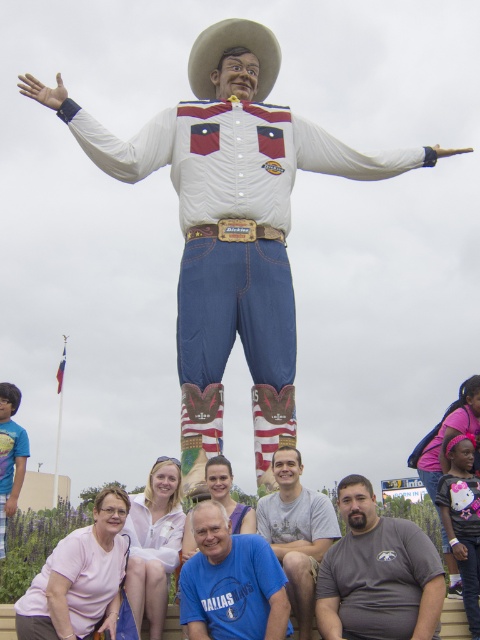
Is gray matte shirt at lower center to the right of blue t-shirt at lower center from the viewer's perspective?

Yes, gray matte shirt at lower center is to the right of blue t-shirt at lower center.

Who is positioned more to the left, gray matte shirt at lower center or blue t-shirt at lower center?

blue t-shirt at lower center is more to the left.

Image resolution: width=480 pixels, height=640 pixels. Find the location of `gray matte shirt at lower center`. gray matte shirt at lower center is located at coordinates (377, 573).

Can you confirm if gray cotton t-shirt at center is wider than white felt cowboy hat at upper center?

Incorrect, gray cotton t-shirt at center's width does not surpass white felt cowboy hat at upper center's.

Does gray cotton t-shirt at center have a larger size compared to white felt cowboy hat at upper center?

Actually, gray cotton t-shirt at center might be smaller than white felt cowboy hat at upper center.

Is point (312, 595) farther from camera compared to point (249, 26)?

No, (312, 595) is closer to viewer.

Identify the location of gray cotton t-shirt at center. (297, 532).

Is gray matte shirt at lower center above gray cotton t-shirt at center?

Actually, gray matte shirt at lower center is below gray cotton t-shirt at center.

Between point (419, 568) and point (307, 500), which one is positioned in front?

Positioned in front is point (419, 568).

Find the location of a particular element. The image size is (480, 640). gray matte shirt at lower center is located at coordinates (377, 573).